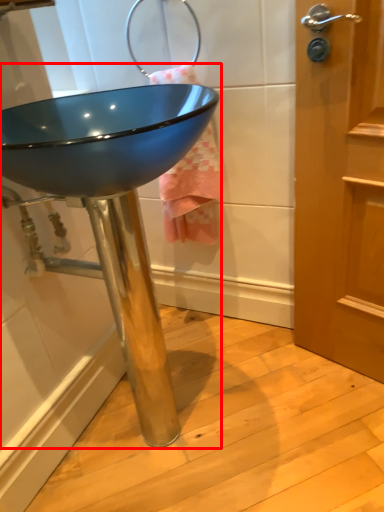
Question: Where is sink (annotated by the red box) located in relation to bath towel in the image?

Choices:
 (A) left
 (B) right

Answer: (A)